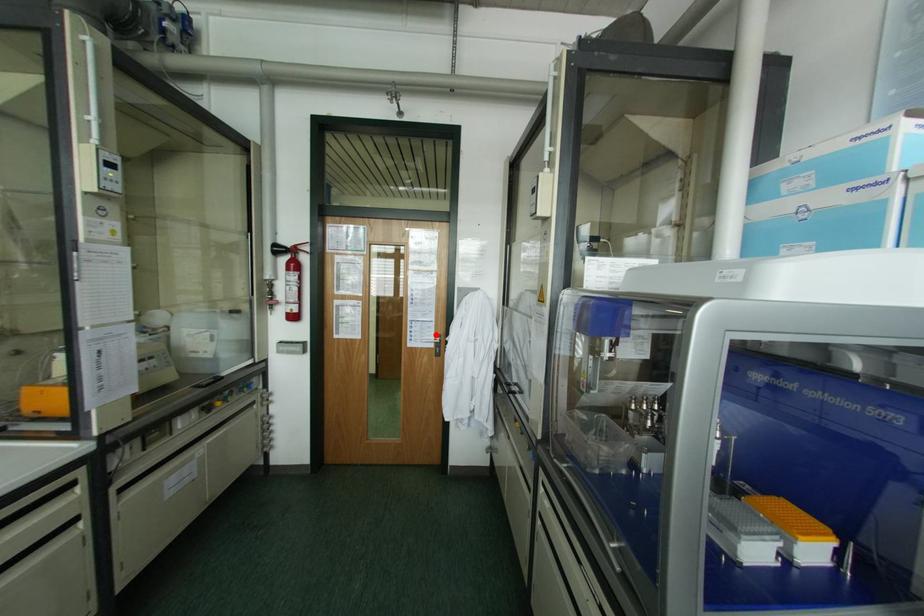
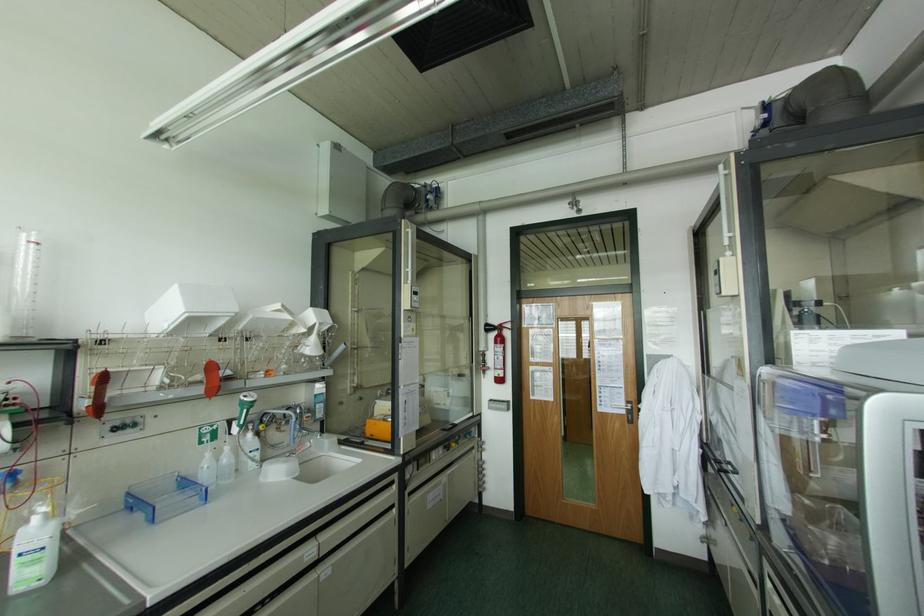
Where in the second image is the point corresponding to the highlighted location from the first image?

(626, 400)